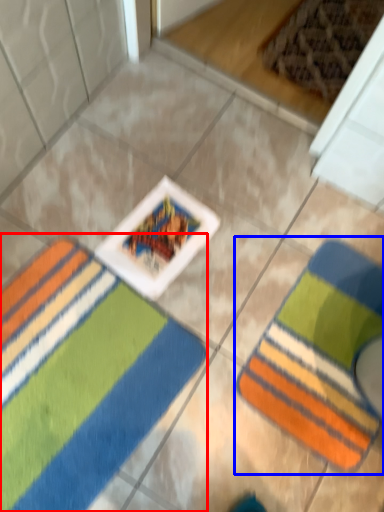
Question: Which object appears farthest to the camera in this image, towel (highlighted by a red box) or towel (highlighted by a blue box)?

Choices:
 (A) towel
 (B) towel

Answer: (B)